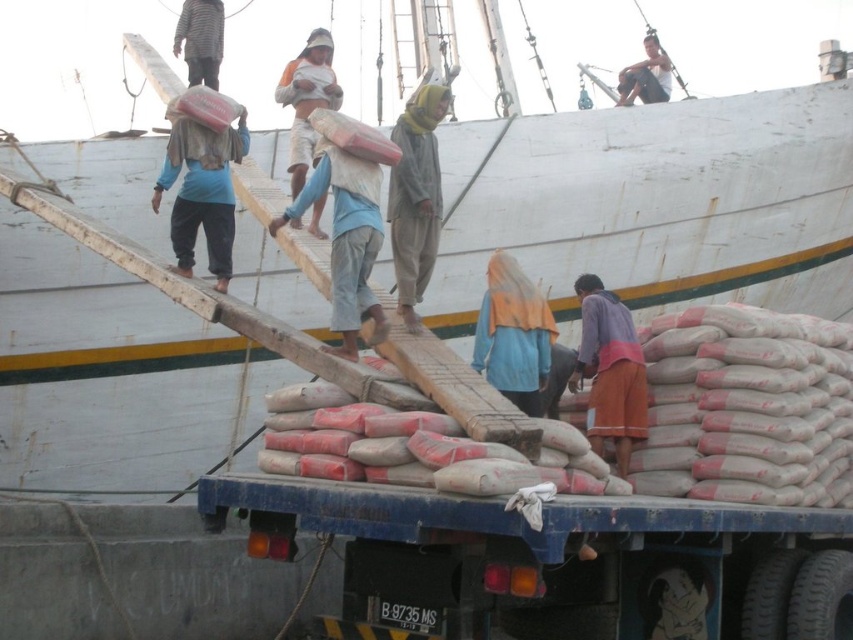
Is point (300, 86) positioned after point (634, 83)?

No, it is not.

Can you confirm if orange fabric headscarf at upper center is shorter than light brown wooden plank at upper center?

Yes, orange fabric headscarf at upper center is shorter than light brown wooden plank at upper center.

What do you see at coordinates (306, 99) in the screenshot? I see `orange fabric headscarf at upper center` at bounding box center [306, 99].

This screenshot has width=853, height=640. What are the coordinates of `orange fabric headscarf at upper center` in the screenshot? It's located at 306,99.

Is light blue fabric bag at center to the left of light brown wooden plank at upper center from the viewer's perspective?

Yes, light blue fabric bag at center is to the left of light brown wooden plank at upper center.

Who is positioned more to the right, light blue fabric bag at center or light brown wooden plank at upper center?

light brown wooden plank at upper center is more to the right.

Which is behind, point (343, 252) or point (660, 99)?

Positioned behind is point (660, 99).

You are a GUI agent. You are given a task and a screenshot of the screen. Output one action in this format:
    pyautogui.click(x=<x>, y=<y>)
    Task: Click on the light blue fabric bag at center
    This screenshot has height=640, width=853.
    Given the screenshot: What is the action you would take?
    pyautogui.click(x=347, y=220)

Which is behind, point (331, 180) or point (296, 148)?

The point (296, 148) is more distant.

Between light blue fabric bag at center and orange fabric headscarf at upper center, which one is positioned lower?

light blue fabric bag at center is below.

Which is behind, point (341, 344) or point (323, 74)?

The point (323, 74) is behind.

Locate an element on the screen. The width and height of the screenshot is (853, 640). light blue fabric bag at center is located at coordinates 347,220.